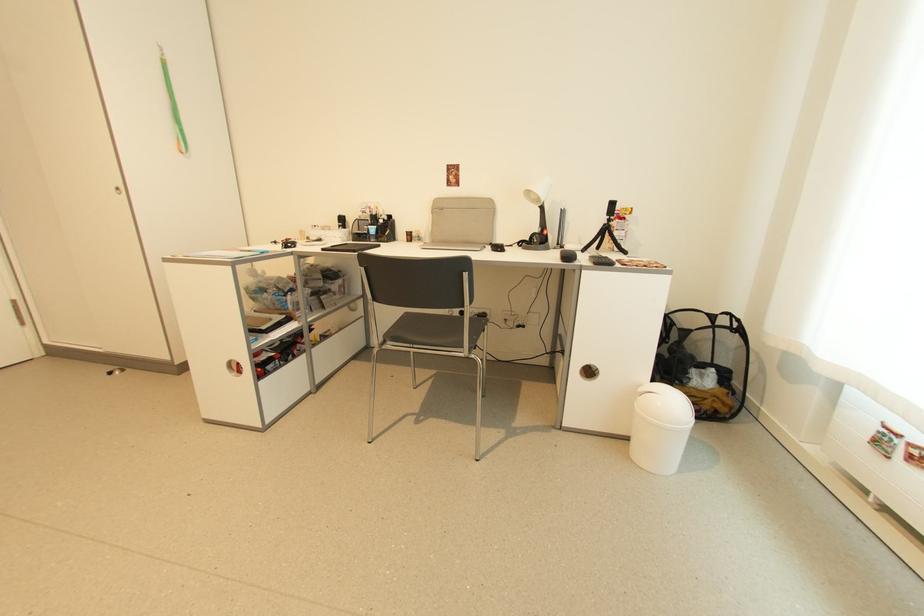
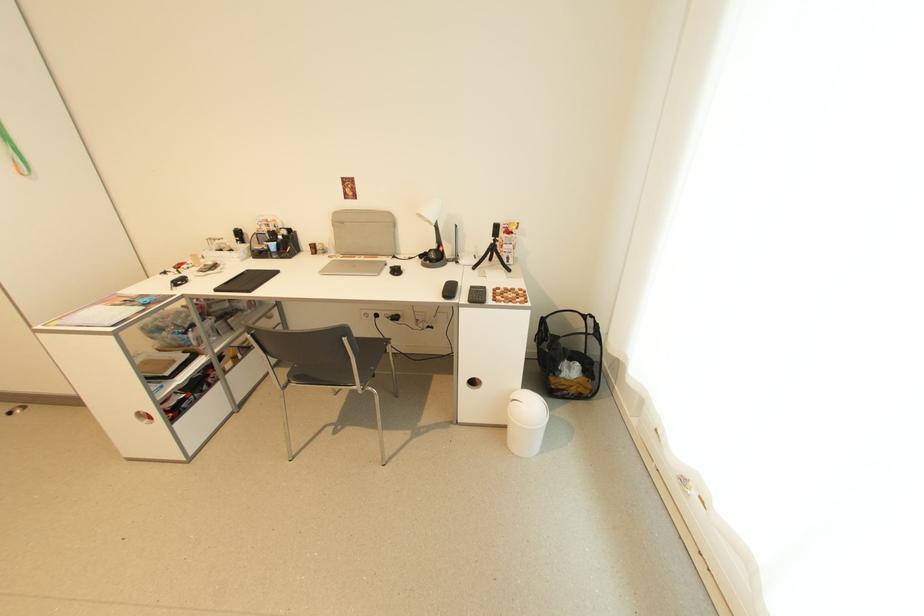
Find the pixel in the second image that matches point (664, 405) in the first image.

(529, 410)